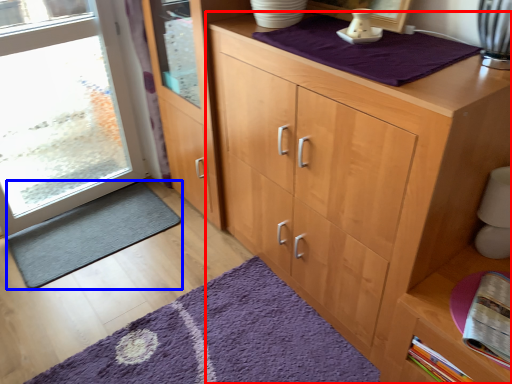
Question: Which object appears farthest to the camera in this image, cupboard (highlighted by a red box) or doormat (highlighted by a blue box)?

Choices:
 (A) cupboard
 (B) doormat

Answer: (B)